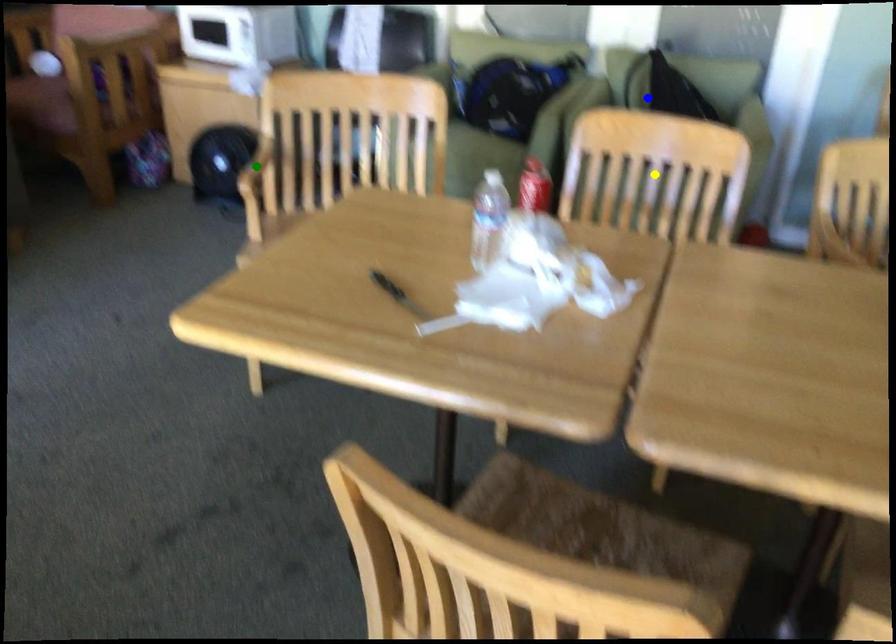
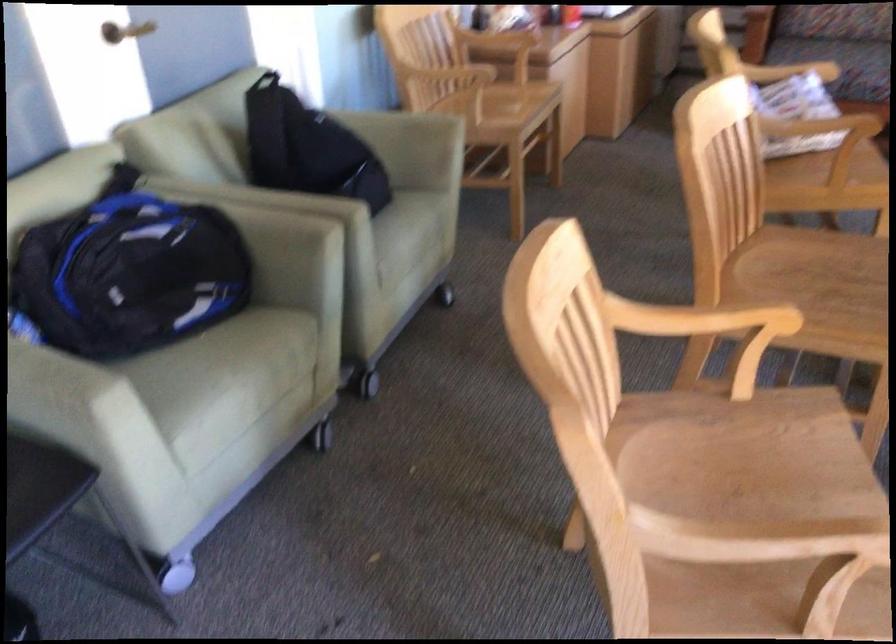
I am providing you with two images of the same scene from different viewpoints. Three points are marked in image1. Which point corresponds to a part or object that is occluded in image2?In image1, three points are marked. Which of them correspond to a part or object that is occluded in image2?Among the three points shown in image1, which one corresponds to a part or object that is no longer visible due to occlusion in image2?

green point, yellow point cannot be seen in image2.